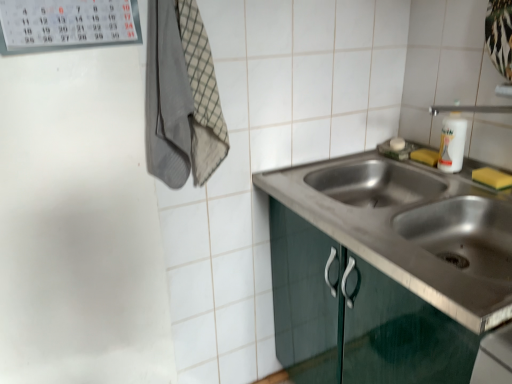
Question: Is the depth of yellow sponge at right, which is the second soap in top-to-bottom order, greater than that of yellow sponge at sink right, arranged as the first soap when viewed from the top?

Choices:
 (A) yes
 (B) no

Answer: (B)

Question: Can you confirm if yellow sponge at right, arranged as the first soap when ordered from the bottom, is taller than yellow sponge at sink right, the second soap positioned from the right?

Choices:
 (A) no
 (B) yes

Answer: (B)

Question: Can you confirm if yellow sponge at right, which ranks as the second soap in back-to-front order, is wider than yellow sponge at sink right, arranged as the first soap when viewed from the top?

Choices:
 (A) yes
 (B) no

Answer: (A)

Question: Is yellow sponge at right, which ranks as the second soap in back-to-front order, positioned before yellow sponge at sink right, arranged as the first soap when viewed from the top?

Choices:
 (A) no
 (B) yes

Answer: (B)

Question: Is yellow sponge at right, which is the 1th soap in front-to-back order, smaller than yellow sponge at sink right, the second soap positioned from the right?

Choices:
 (A) yes
 (B) no

Answer: (A)

Question: In the image, is yellow sponge at right, which is the 2th soap in left-to-right order, positioned in front of or behind yellow sponge at sink right, which appears as the first soap when viewed from the back?

Choices:
 (A) behind
 (B) front

Answer: (B)

Question: Is yellow sponge at right, arranged as the first soap when ordered from the bottom, situated inside yellow sponge at sink right, arranged as the 2th soap when ordered from the bottom, or outside?

Choices:
 (A) inside
 (B) outside

Answer: (B)

Question: In terms of width, does yellow sponge at right, which is the second soap in top-to-bottom order, look wider or thinner when compared to yellow sponge at sink right, placed as the first soap when sorted from left to right?

Choices:
 (A) thin
 (B) wide

Answer: (B)

Question: Based on their sizes in the image, would you say yellow sponge at right, which ranks as the second soap in back-to-front order, is bigger or smaller than yellow sponge at sink right, positioned as the second soap in front-to-back order?

Choices:
 (A) small
 (B) big

Answer: (A)

Question: In terms of height, does gray cotton towel at upper left look taller or shorter compared to yellow sponge at right, arranged as the first soap when ordered from the bottom?

Choices:
 (A) tall
 (B) short

Answer: (A)

Question: Is gray cotton towel at upper left situated inside yellow sponge at right, which is the second soap in top-to-bottom order, or outside?

Choices:
 (A) inside
 (B) outside

Answer: (B)

Question: Considering their positions, is gray cotton towel at upper left located in front of or behind yellow sponge at right, arranged as the first soap when viewed from the right?

Choices:
 (A) behind
 (B) front

Answer: (B)

Question: Based on their positions, is gray cotton towel at upper left located to the left or right of yellow sponge at right, which ranks as the second soap in back-to-front order?

Choices:
 (A) right
 (B) left

Answer: (B)

Question: Relative to stainless steel sink at center, is yellow sponge at sink right, the second soap positioned from the right, in front or behind?

Choices:
 (A) behind
 (B) front

Answer: (A)

Question: Considering the relative positions of yellow sponge at sink right, positioned as the second soap in front-to-back order, and stainless steel sink at center in the image provided, is yellow sponge at sink right, positioned as the second soap in front-to-back order, to the left or to the right of stainless steel sink at center?

Choices:
 (A) left
 (B) right

Answer: (B)